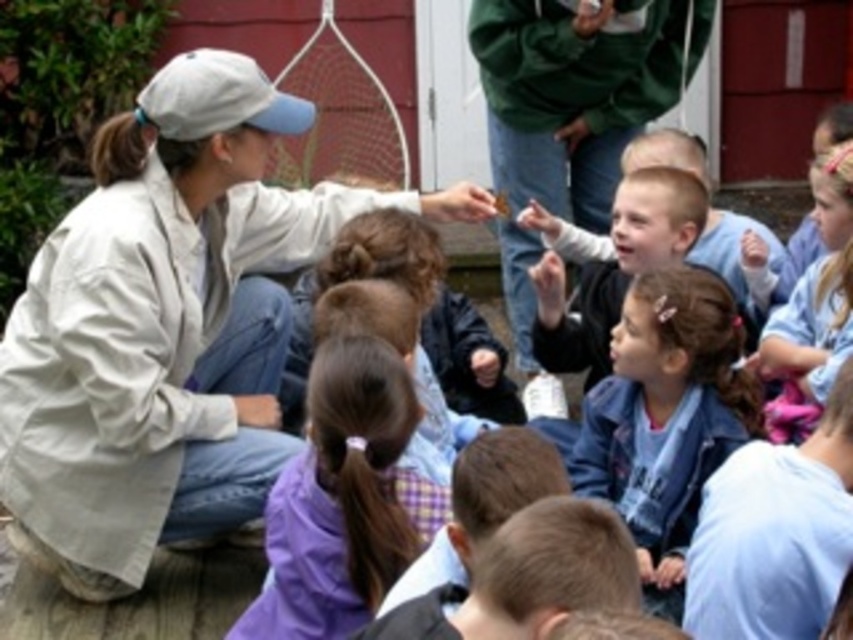
Question: Among these objects, which one is nearest to the camera?

Choices:
 (A) green matte jacket at upper center
 (B) purple plaid shirt at center
 (C) denim jacket at center
 (D) light beige jacket at upper left

Answer: (B)

Question: Can you confirm if denim jacket at center is positioned to the left of purple plaid shirt at center?

Choices:
 (A) no
 (B) yes

Answer: (A)

Question: Is light beige jacket at upper left closer to the viewer compared to light blue denim jacket at upper right?

Choices:
 (A) no
 (B) yes

Answer: (A)

Question: Does denim jacket at center appear under purple plaid shirt at center?

Choices:
 (A) yes
 (B) no

Answer: (B)

Question: Among these points, which one is farthest from the camera?

Choices:
 (A) (706, 452)
 (B) (722, 492)
 (C) (213, 228)
 (D) (525, 141)

Answer: (D)

Question: Among these points, which one is farthest from the camera?

Choices:
 (A) (751, 435)
 (B) (524, 294)

Answer: (B)